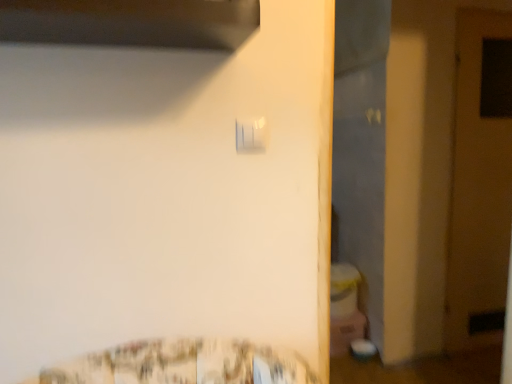
Question: Is wooden door at right taller or shorter than white plastic light switch at upper center?

Choices:
 (A) short
 (B) tall

Answer: (B)

Question: Is wooden door at right in front of or behind white plastic light switch at upper center in the image?

Choices:
 (A) behind
 (B) front

Answer: (A)

Question: From a real-world perspective, is wooden door at right physically located above or below white plastic light switch at upper center?

Choices:
 (A) below
 (B) above

Answer: (A)

Question: Would you say white plastic light switch at upper center is inside or outside wooden door at right?

Choices:
 (A) outside
 (B) inside

Answer: (A)

Question: Visually, is white plastic light switch at upper center positioned to the left or to the right of wooden door at right?

Choices:
 (A) left
 (B) right

Answer: (A)

Question: From the image's perspective, relative to wooden door at right, is white plastic light switch at upper center above or below?

Choices:
 (A) above
 (B) below

Answer: (A)

Question: In terms of height, does white plastic light switch at upper center look taller or shorter compared to wooden door at right?

Choices:
 (A) short
 (B) tall

Answer: (A)